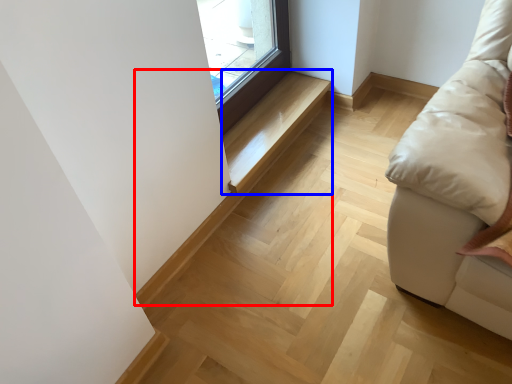
Question: Which object appears farthest to the camera in this image, stairwell (highlighted by a red box) or stairwell (highlighted by a blue box)?

Choices:
 (A) stairwell
 (B) stairwell

Answer: (B)